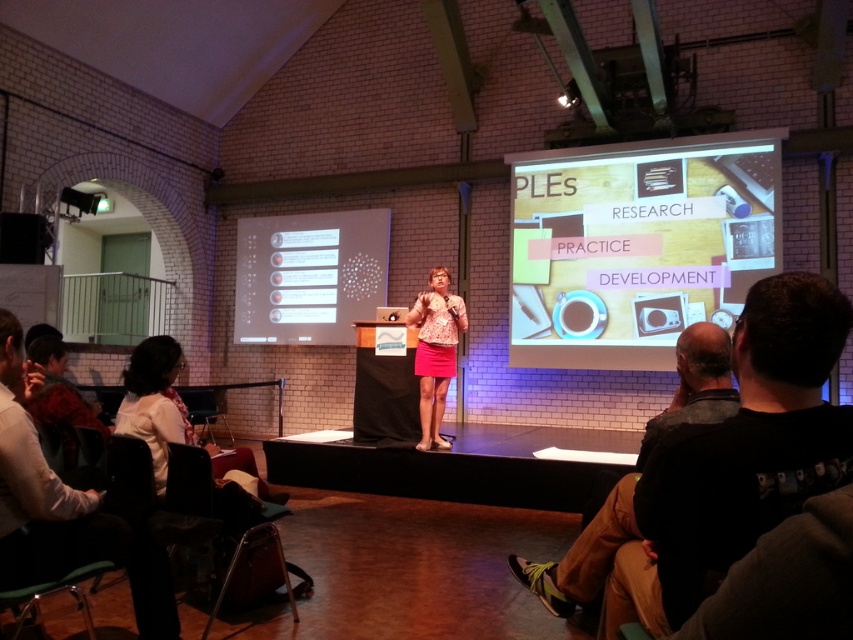
Question: Which of the following is the farthest from the observer?

Choices:
 (A) metallic silver chair at lower left
 (B) white shirt at lower left
 (C) metallic gray chair at lower left
 (D) pink fabric skirt at center

Answer: (A)

Question: Which of these objects is positioned closest to the metallic gray chair at lower left?

Choices:
 (A) matte white screen at center
 (B) dark brown leather jacket at lower right
 (C) pink fabric skirt at center

Answer: (B)

Question: Does woodenmaterial/textureprojection screen at upper center have a smaller size compared to white fabric jacket at lower left?

Choices:
 (A) yes
 (B) no

Answer: (B)

Question: Does woodenmaterial/textureprojection screen at upper center have a lesser width compared to metallic silver chair at lower left?

Choices:
 (A) no
 (B) yes

Answer: (A)

Question: Can you confirm if woodenmaterial/textureprojection screen at upper center is positioned below metallic silver chair at lower left?

Choices:
 (A) yes
 (B) no

Answer: (B)

Question: Which of these objects is positioned closest to the woodenmaterial/textureprojection screen at upper center?

Choices:
 (A) white shirt at lower left
 (B) white fabric jacket at lower left
 (C) metallic silver chair at lower left
 (D) matte white screen at center

Answer: (D)